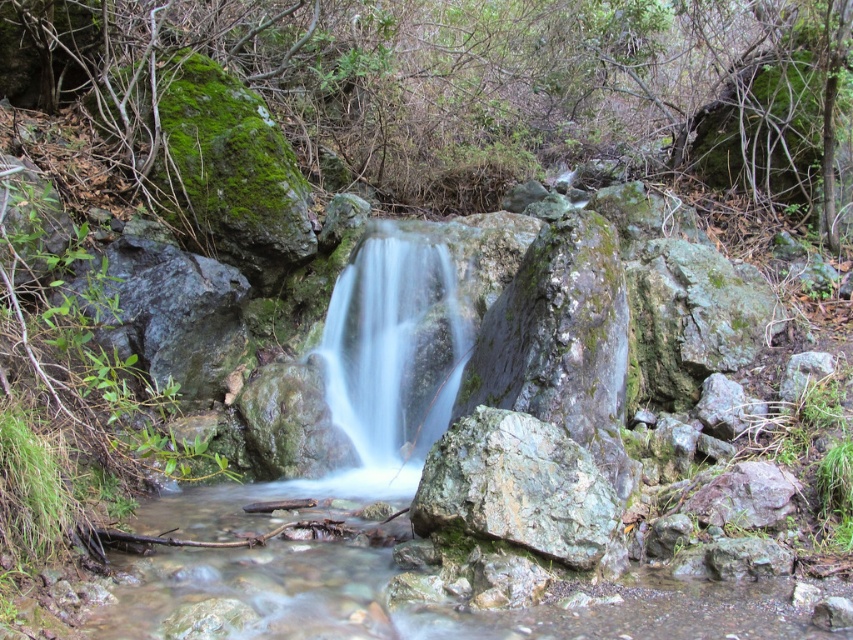
Consider the image. You are a photographer planning to capture the waterfall scene. You want to ensure that the clear water at center flows over the gray rough rock at center in your shot. Based on the scene description, will the water naturally flow over the rock?

The clear water at center is taller than gray rough rock at center, so yes, the water will naturally flow over the rock since it is higher in elevation.

You are a photographer planning to capture the waterfall scene. You want to ensure the clear water at center and the gray rough rock at center are both visible in your shot. Given their sizes, which object will occupy more of the frame?

The clear water at center has a larger size compared to the gray rough rock at center, so it will occupy more of the frame.